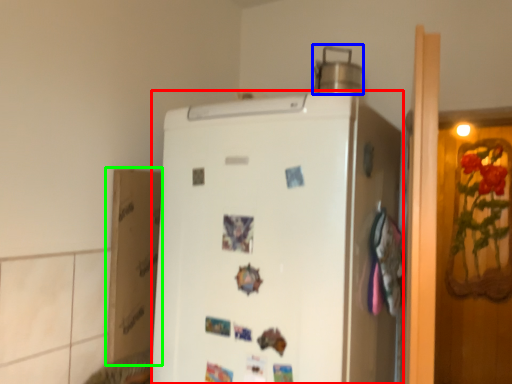
Question: Estimate the real-world distances between objects in this image. Which object is farther from refrigerator (highlighted by a red box), appliance (highlighted by a blue box) or cardboard box (highlighted by a green box)?

Choices:
 (A) appliance
 (B) cardboard box

Answer: (A)